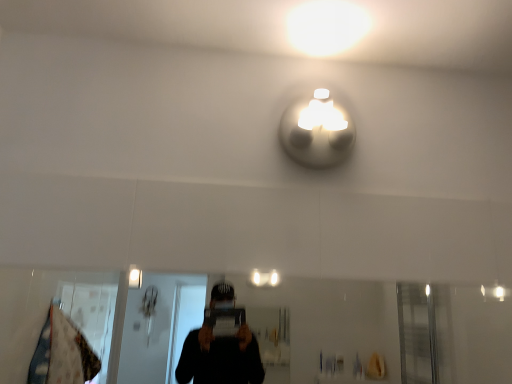
Question: Is transparent glass mirror at lower center to the right of white glossy light fixture at upper center from the viewer's perspective?

Choices:
 (A) yes
 (B) no

Answer: (B)

Question: Can you confirm if transparent glass mirror at lower center is wider than white glossy light fixture at upper center?

Choices:
 (A) no
 (B) yes

Answer: (A)

Question: Considering the relative sizes of transparent glass mirror at lower center and white glossy light fixture at upper center in the image provided, is transparent glass mirror at lower center bigger than white glossy light fixture at upper center?

Choices:
 (A) yes
 (B) no

Answer: (A)

Question: Considering the relative sizes of transparent glass mirror at lower center and white glossy light fixture at upper center in the image provided, is transparent glass mirror at lower center thinner than white glossy light fixture at upper center?

Choices:
 (A) yes
 (B) no

Answer: (A)

Question: Is transparent glass mirror at lower center aimed at white glossy light fixture at upper center?

Choices:
 (A) yes
 (B) no

Answer: (B)

Question: Is transparent glass mirror at lower center not near white glossy light fixture at upper center?

Choices:
 (A) no
 (B) yes

Answer: (B)

Question: Is white glossy light fixture at upper center positioned far away from transparent glass mirror at lower center?

Choices:
 (A) no
 (B) yes

Answer: (B)

Question: Could you tell me if white glossy light fixture at upper center is turned towards transparent glass mirror at lower center?

Choices:
 (A) no
 (B) yes

Answer: (A)

Question: Considering the relative sizes of white glossy light fixture at upper center and transparent glass mirror at lower center in the image provided, is white glossy light fixture at upper center bigger than transparent glass mirror at lower center?

Choices:
 (A) no
 (B) yes

Answer: (A)

Question: Is white glossy light fixture at upper center positioned behind transparent glass mirror at lower center?

Choices:
 (A) yes
 (B) no

Answer: (A)

Question: Is white glossy light fixture at upper center wider than transparent glass mirror at lower center?

Choices:
 (A) yes
 (B) no

Answer: (A)

Question: From the image's perspective, is white glossy light fixture at upper center located above transparent glass mirror at lower center?

Choices:
 (A) yes
 (B) no

Answer: (A)

Question: In the image, is white glossy light fixture at upper center on the left side or the right side of transparent glass mirror at lower center?

Choices:
 (A) left
 (B) right

Answer: (B)